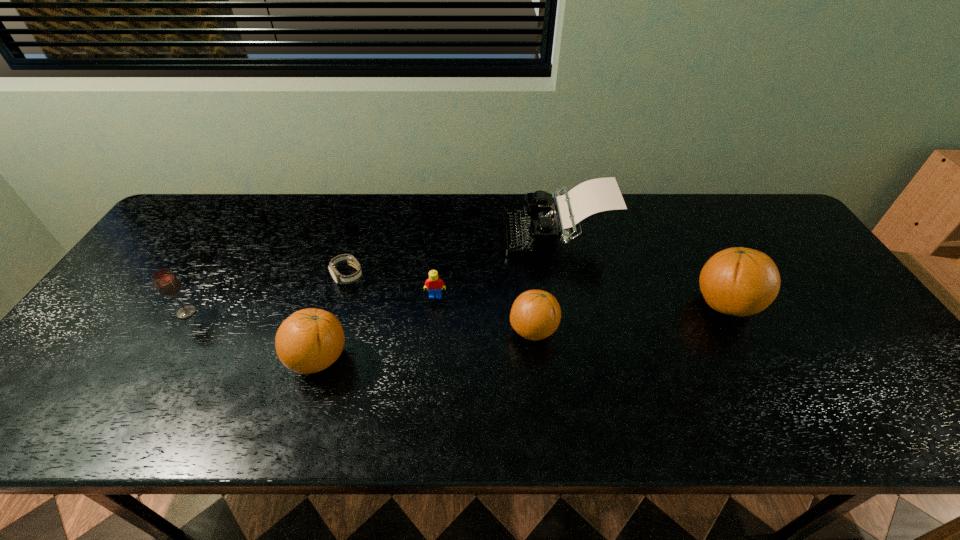
Locate an element on the screen. The image size is (960, 540). free spot located 0.370m on the back of the rightmost orange is located at coordinates (672, 202).

Locate an element on the screen. The image size is (960, 540). vacant point located on the keys of the farthest object is located at coordinates (488, 235).

Locate an element on the screen. The width and height of the screenshot is (960, 540). free space located 0.370m on the keys of the farthest object is located at coordinates (384, 235).

What are the coordinates of `vacant space located on the keys of the farthest object` in the screenshot? It's located at (413, 235).

Image resolution: width=960 pixels, height=540 pixels. I want to click on vacant space located 0.140m on the left of the leftmost object, so click(x=123, y=313).

The image size is (960, 540). Identify the location of free space located 0.320m on the face of the watch. pos(313,392).

Locate an element on the screen. free space located on the face of the second shortest object is located at coordinates (433, 323).

This screenshot has height=540, width=960. Identify the location of object at the far edge. (533, 232).

At what (x,y) coordinates should I click in order to perform the action: click on object that is at the near edge. Please return your answer as a coordinate pair (x, y). This screenshot has width=960, height=540. Looking at the image, I should click on (310, 340).

At what (x,y) coordinates should I click in order to perform the action: click on free spot at the far edge of the desktop. Please return your answer as a coordinate pair (x, y). Looking at the image, I should click on (692, 235).